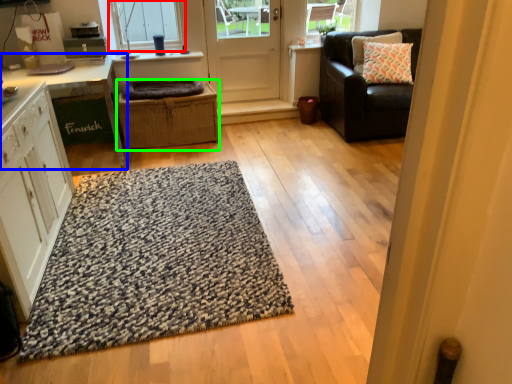
Question: Estimate the real-world distances between objects in this image. Which object is closer to window (highlighted by a red box), table (highlighted by a blue box) or crate (highlighted by a green box)?

Choices:
 (A) table
 (B) crate

Answer: (A)